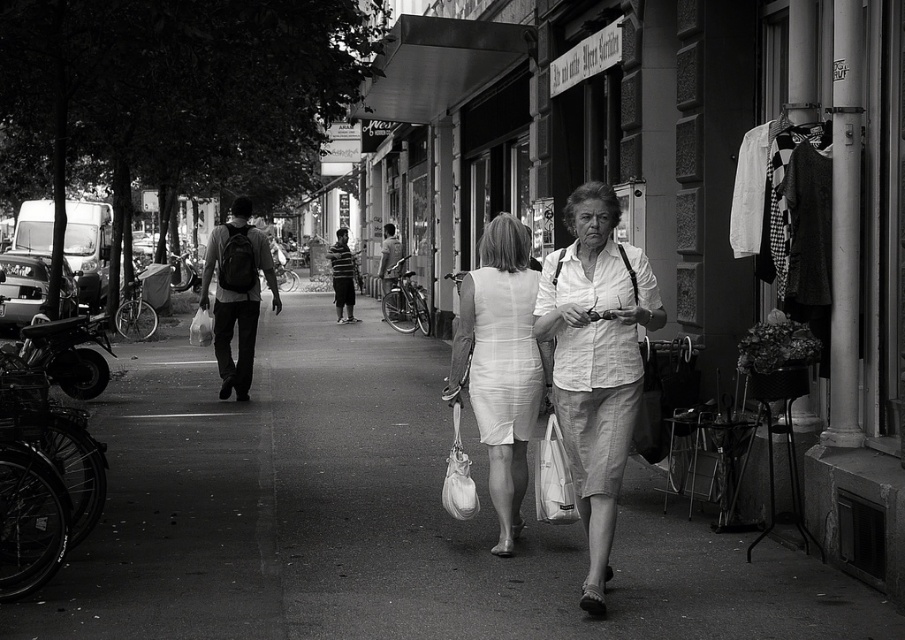
Question: Can you confirm if white cotton dress at center is smaller than striped shirt at center?

Choices:
 (A) yes
 (B) no

Answer: (A)

Question: Which point appears farthest from the camera in this image?

Choices:
 (A) (243, 368)
 (B) (346, 300)

Answer: (B)

Question: Which point is farther from the camera taking this photo?

Choices:
 (A) (183, 595)
 (B) (624, 426)

Answer: (A)

Question: Observing the image, what is the correct spatial positioning of smooth asphalt pavement at center in reference to striped shirt at center?

Choices:
 (A) below
 (B) above

Answer: (A)

Question: Does smooth asphalt pavement at center appear on the right side of white cotton dress at center?

Choices:
 (A) no
 (B) yes

Answer: (A)

Question: Which object is positioned closest to the matte black backpack at center?

Choices:
 (A) smooth asphalt pavement at center
 (B) white textured dress at center

Answer: (A)